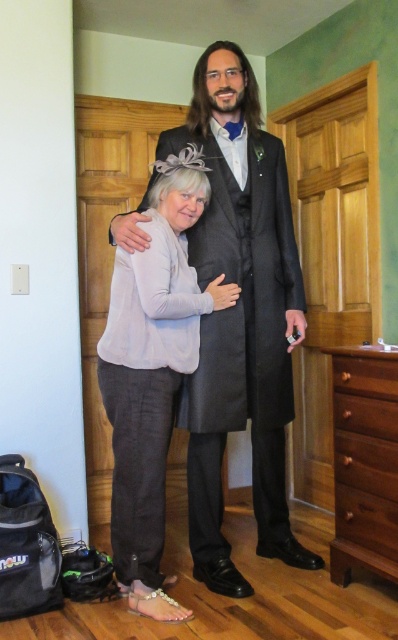
You are standing in the room and want to reach the brown wood drawer at lower right without moving the matte black suit at center. Is this possible?

The matte black suit at center is closer to the viewer than the brown wood drawer at lower right, so you cannot reach the brown wood drawer at lower right without moving the matte black suit at center.

You are a photographer setting up for a portrait session in this room. You need to position a spotlight so it illuminates both the matte black suit at center and the light gray linen blouse at center. Given their positions, where should you place the spotlight relative to the two outfits to ensure both are evenly lit?

The matte black suit at center is located above the light gray linen blouse at center. To evenly light both, position the spotlight above the matte black suit at center so that its light cascades down to both outfits.

You are organizing a formal event and need to place a decorative item on the brown wood drawer at lower right. The matte black suit at center is currently above it. Can you place the decorative item there without moving the suit?

The matte black suit at center is above the brown wood drawer at lower right, so placing a decorative item on the drawer would require moving the suit first since it is currently occupying the space above the drawer.